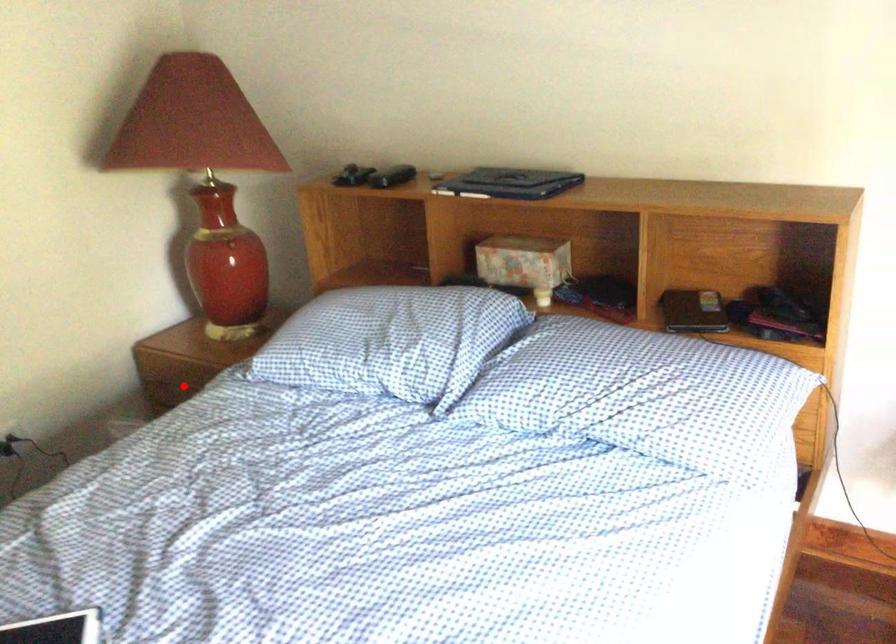
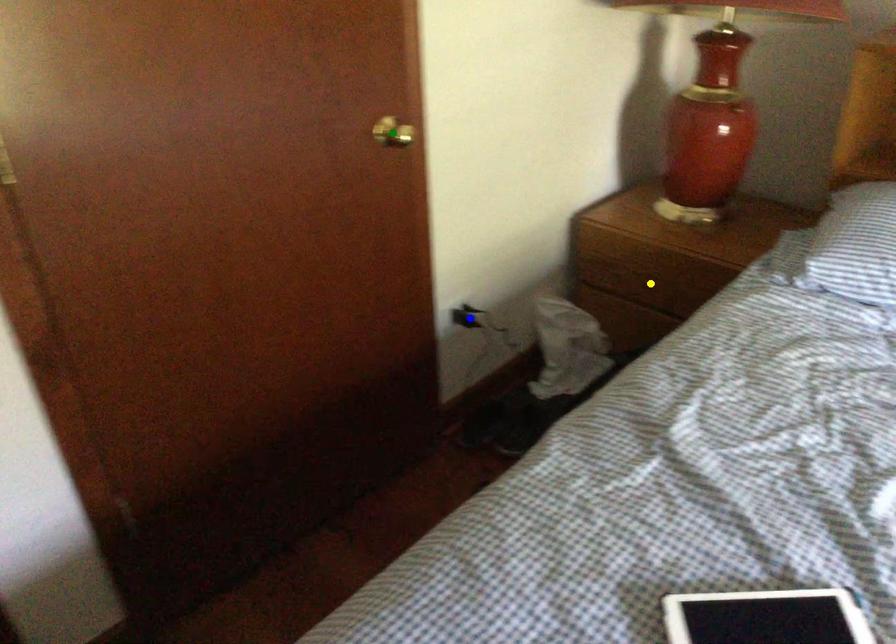
Question: I am providing you with two images of the same scene from different viewpoints. A red point is marked on the first image. You are given multiple points on the second image. Which spot in image 2 lines up with the point in image 1?

Choices:
 (A) green point
 (B) blue point
 (C) yellow point

Answer: (C)